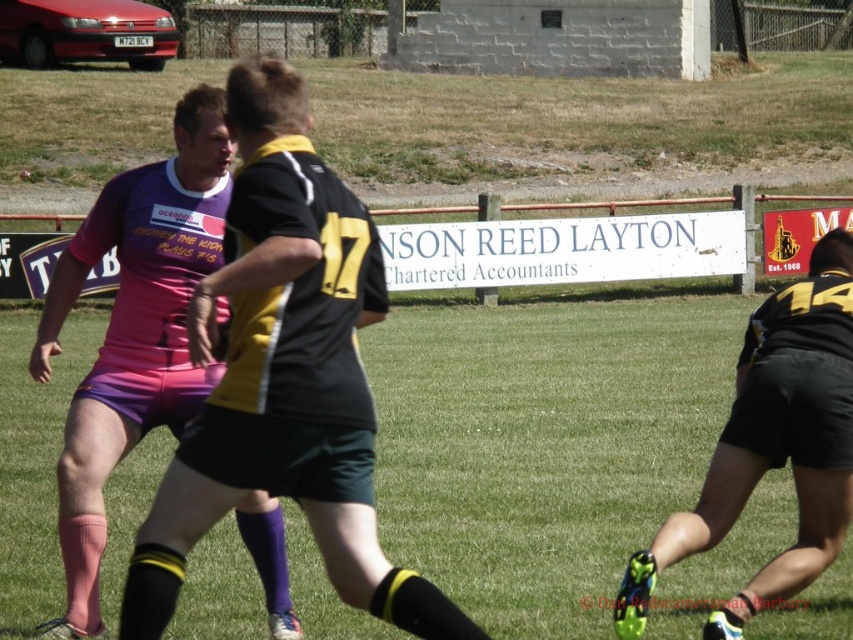
You are a photographer trying to capture the rugby player wearing pink fabric shorts at center. Based on the coordinates provided, where should you aim your camera to ensure the shorts are in the frame?

You should aim your camera at point 0.517 on the horizontal axis and point 0.158 on the vertical axis to capture the pink fabric shorts at center.

You are a sports analyst watching the rugby match. You notice two items in the image labeled as the matte black jersey at center and the black matte shorts at right. Which of these two items is positioned higher up in the image?

The matte black jersey at center is positioned higher up in the image than the black matte shorts at right because it is taller.